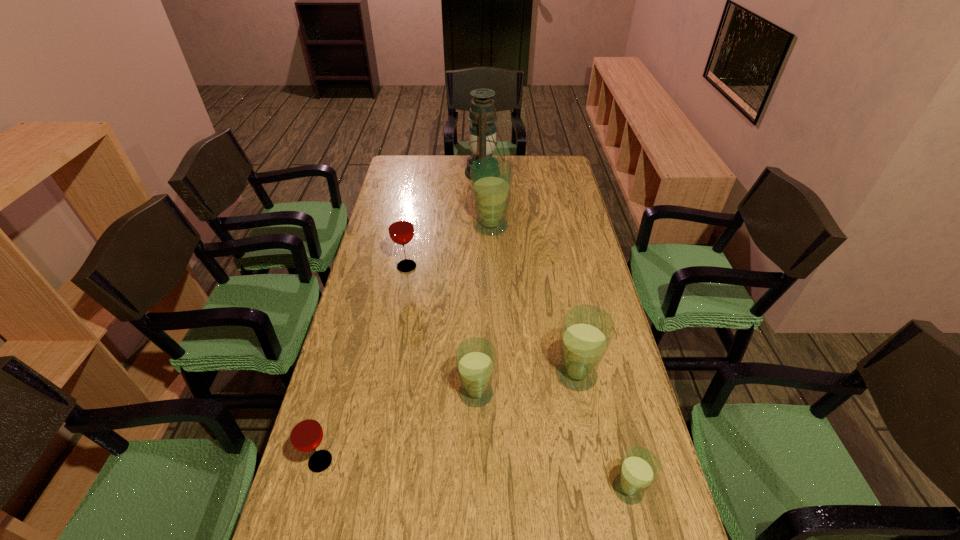
I want to click on blank space at the far edge, so click(449, 177).

Image resolution: width=960 pixels, height=540 pixels. In order to click on vacant space at the left edge of the desktop in this screenshot , I will do `click(379, 284)`.

Locate an element on the screen. The image size is (960, 540). blank space at the right edge of the desktop is located at coordinates (593, 272).

In order to click on vacant area that lies between the second farthest object and the fifth glass from right to left in this screenshot , I will do `click(448, 247)`.

Locate an element on the screen. This screenshot has height=540, width=960. free space between the second tallest object and the third smallest blue glass is located at coordinates (534, 301).

I want to click on vacant space that is in between the rust oil lamp and the nearest blue glass, so click(x=557, y=331).

Find the location of `vacant space in between the second smallest blue glass and the third smallest blue glass`. vacant space in between the second smallest blue glass and the third smallest blue glass is located at coordinates (526, 384).

I want to click on vacant space that is in between the third smallest blue glass and the bigger red glass, so click(492, 321).

I want to click on unoccupied area between the farther red glass and the third smallest blue glass, so click(492, 321).

Find the location of `free space between the third biggest blue glass and the oil lamp`. free space between the third biggest blue glass and the oil lamp is located at coordinates (480, 283).